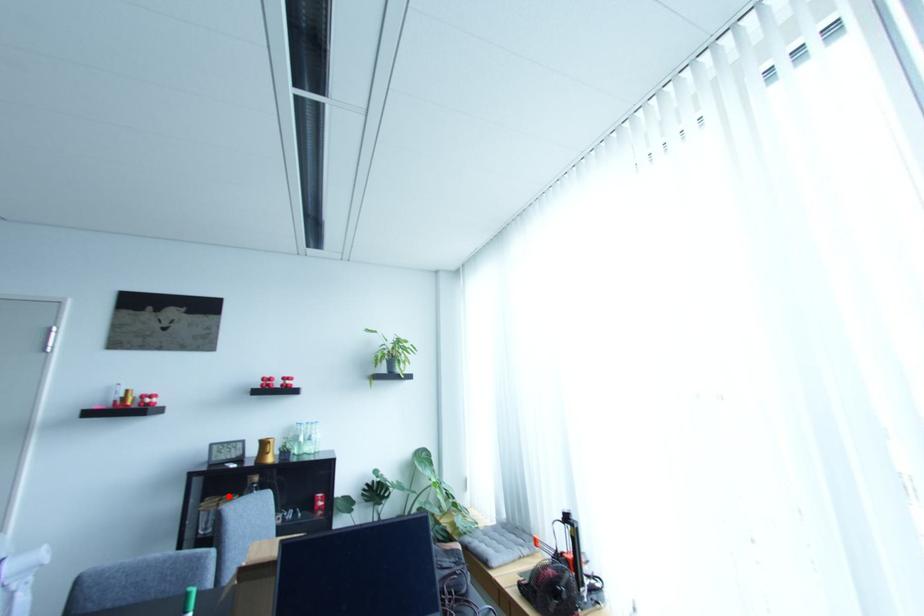
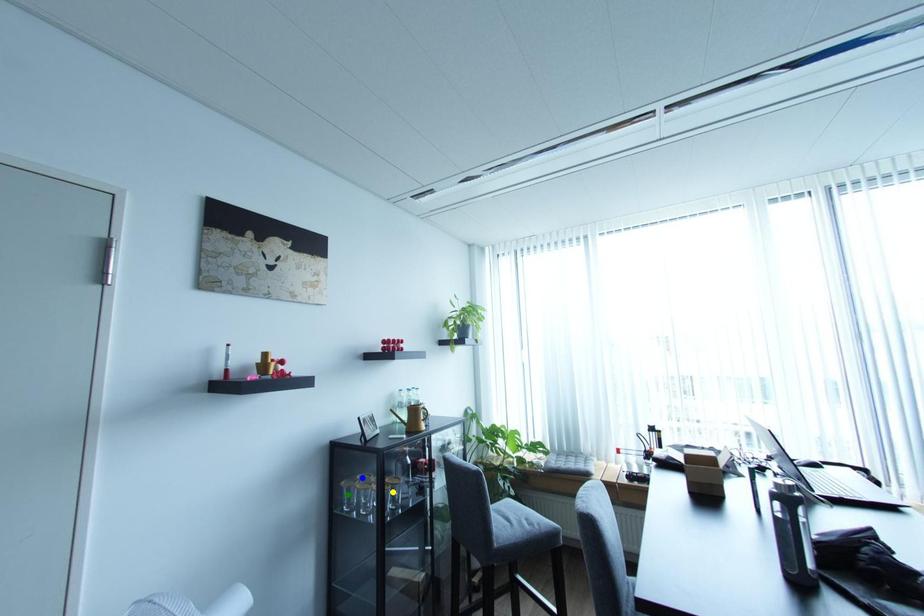
Question: I am providing you with two images of the same scene from different viewpoints. A red point is marked on the first image. You are given multiple points on the second image. Can you choose the point in image 2 that corresponds to the point in image 1?

Choices:
 (A) blue point
 (B) yellow point
 (C) green point

Answer: (A)